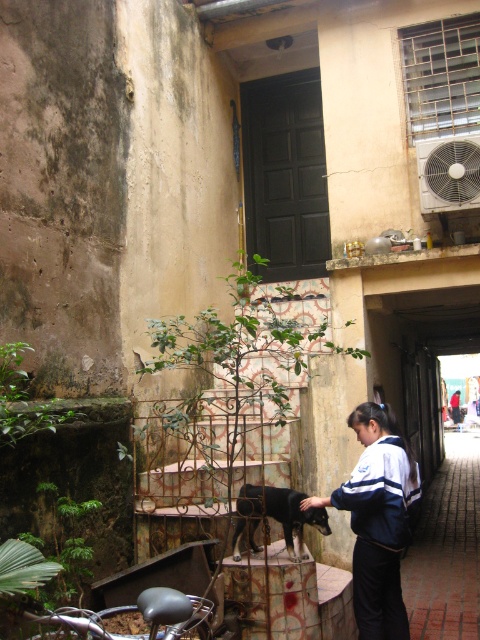
Who is taller, dark blue uniform at lower right or black fur dog at center?

dark blue uniform at lower right

Between point (442, 611) and point (269, 512), which one is positioned behind?

Positioned behind is point (442, 611).

Does point (451, 467) lie behind point (288, 499)?

Yes, it is behind point (288, 499).

Identify the location of dark blue uniform at lower right. (446, 548).

Does dark blue uniform at lower right come in front of dark blue uniform at center?

Yes, dark blue uniform at lower right is in front of dark blue uniform at center.

In the scene shown: Can you confirm if dark blue uniform at lower right is positioned above dark blue uniform at center?

Actually, dark blue uniform at lower right is below dark blue uniform at center.

Image resolution: width=480 pixels, height=640 pixels. What are the coordinates of `dark blue uniform at lower right` in the screenshot? It's located at (446, 548).

I want to click on dark blue uniform at lower right, so click(446, 548).

Is point (403, 604) positioned after point (265, 490)?

That is False.

Does blue-and-white jacket at center have a smaller size compared to black fur dog at center?

No.

Who is more distant from viewer, (406, 536) or (255, 544)?

The point (255, 544) is behind.

The image size is (480, 640). Identify the location of blue-and-white jacket at center. (377, 518).